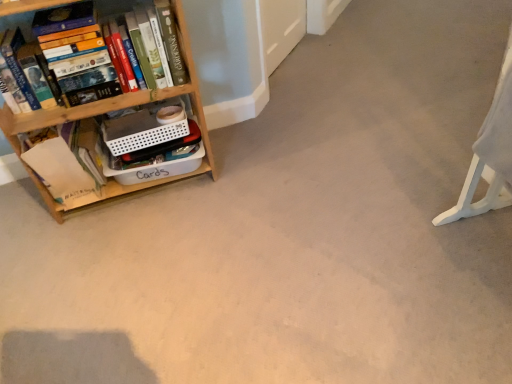
Image resolution: width=512 pixels, height=384 pixels. I want to click on unoccupied area in front of wooden bookshelf at left, so click(x=128, y=259).